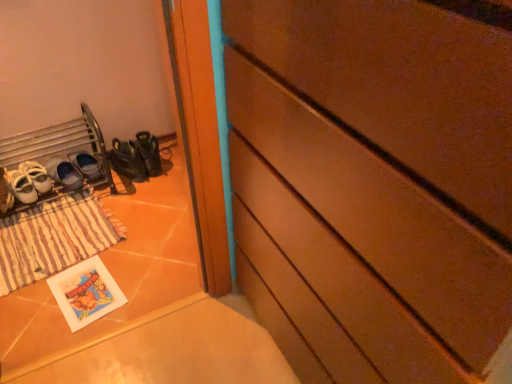
Question: Should I look upward or downward to see brown matte chest of drawers at center?

Choices:
 (A) down
 (B) up

Answer: (A)

Question: Is brown matte chest of drawers at center next to matte paper postcard at lower left and touching it?

Choices:
 (A) no
 (B) yes

Answer: (A)

Question: Considering the relative positions of brown matte chest of drawers at center and matte paper postcard at lower left in the image provided, is brown matte chest of drawers at center to the left of matte paper postcard at lower left from the viewer's perspective?

Choices:
 (A) yes
 (B) no

Answer: (B)

Question: Are brown matte chest of drawers at center and matte paper postcard at lower left far apart?

Choices:
 (A) no
 (B) yes

Answer: (B)

Question: Does brown matte chest of drawers at center have a greater width compared to matte paper postcard at lower left?

Choices:
 (A) yes
 (B) no

Answer: (A)

Question: Is brown matte chest of drawers at center shorter than matte paper postcard at lower left?

Choices:
 (A) no
 (B) yes

Answer: (A)

Question: From a real-world perspective, is brown matte chest of drawers at center below matte paper postcard at lower left?

Choices:
 (A) yes
 (B) no

Answer: (B)

Question: From the image's perspective, is matte black shoes at lower left, which is counted as the 4th footwear, starting from the left, over white leather shoes at left, placed as the 3th footwear when sorted from left to right?

Choices:
 (A) no
 (B) yes

Answer: (B)

Question: Can you confirm if matte black shoes at lower left, which is counted as the 4th footwear, starting from the left, is shorter than white leather shoes at left, positioned as the 2th footwear in right-to-left order?

Choices:
 (A) yes
 (B) no

Answer: (A)

Question: Is matte black shoes at lower left, the first footwear when ordered from right to left, at the right side of white leather shoes at left, placed as the 3th footwear when sorted from left to right?

Choices:
 (A) yes
 (B) no

Answer: (A)

Question: Is matte black shoes at lower left, the first footwear when ordered from right to left, located outside white leather shoes at left, placed as the 3th footwear when sorted from left to right?

Choices:
 (A) no
 (B) yes

Answer: (B)

Question: Is matte black shoes at lower left, the first footwear when ordered from right to left, bigger than white leather shoes at left, positioned as the 2th footwear in right-to-left order?

Choices:
 (A) yes
 (B) no

Answer: (B)

Question: Can you confirm if matte black shoes at lower left, which is counted as the 4th footwear, starting from the left, is positioned to the left of white leather shoes at left, positioned as the 2th footwear in right-to-left order?

Choices:
 (A) no
 (B) yes

Answer: (A)

Question: From a real-world perspective, is brown striped mat at lower left on matte black shoes at lower left, which is counted as the 4th footwear, starting from the left?

Choices:
 (A) yes
 (B) no

Answer: (B)